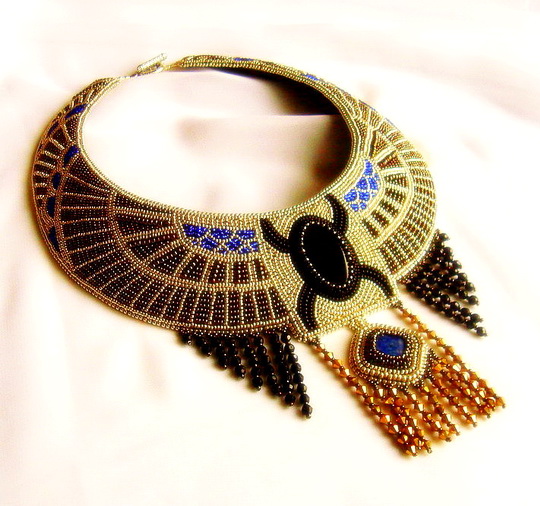
Locate an element on the screen. Image resolution: width=540 pixels, height=506 pixels. long chains of orange or golden beads is located at coordinates (410, 449), (416, 440), (418, 431), (435, 424), (447, 419), (463, 411), (478, 407), (497, 399), (490, 403).